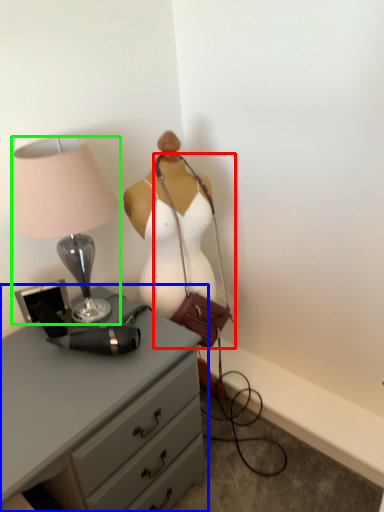
Question: Which object is positioned farthest from handbag (highlighted by a red box)? Select from chest of drawers (highlighted by a blue box) and lamp (highlighted by a green box).

Choices:
 (A) chest of drawers
 (B) lamp

Answer: (A)